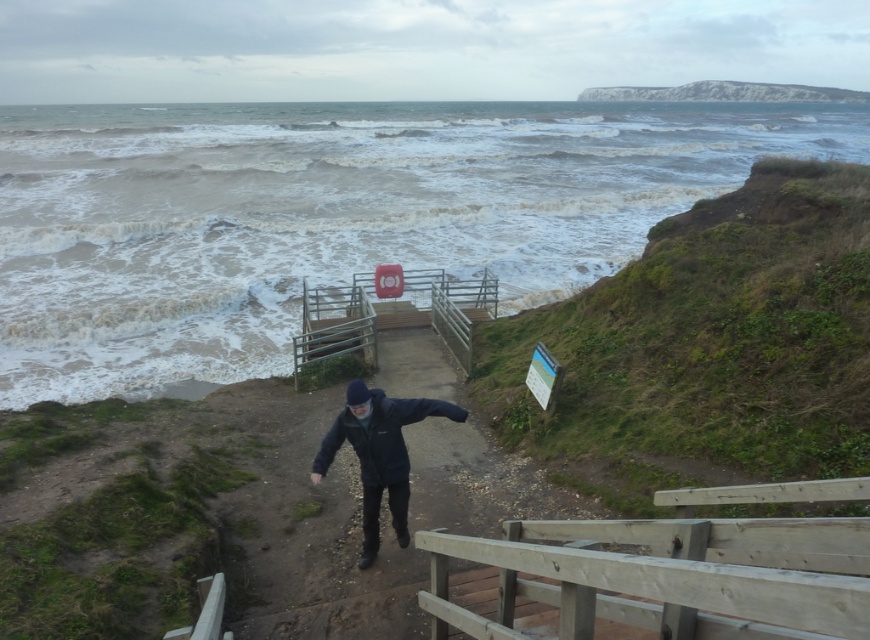
How much distance is there between green grassy cliff at right and wooden balustrade at lower right?

green grassy cliff at right and wooden balustrade at lower right are 8.47 meters apart.

Does green grassy cliff at right appear under wooden balustrade at lower right?

Actually, green grassy cliff at right is above wooden balustrade at lower right.

Is point (673, 282) less distant than point (864, 600)?

No, it is not.

This screenshot has width=870, height=640. I want to click on green grassy cliff at right, so click(x=706, y=346).

From the picture: Which of these two, wooden at center or white rocky cliff at upper right, stands taller?

white rocky cliff at upper right

From the picture: Is wooden at center bigger than white rocky cliff at upper right?

Incorrect, wooden at center is not larger than white rocky cliff at upper right.

Find the location of a particular element. Image resolution: width=870 pixels, height=640 pixels. wooden at center is located at coordinates (390, 314).

You are a GUI agent. You are given a task and a screenshot of the screen. Output one action in this format:
    pyautogui.click(x=<x>, y=<y>)
    Task: Click on the wooden at center
    The image size is (870, 640).
    Given the screenshot: What is the action you would take?
    pyautogui.click(x=390, y=314)

Can you confirm if wooden at center is shorter than dark blue jacket at center?

Indeed, wooden at center has a lesser height compared to dark blue jacket at center.

Consider the image. Is wooden at center further to the viewer compared to dark blue jacket at center?

Yes, wooden at center is further from the viewer.

What do you see at coordinates (390, 314) in the screenshot? This screenshot has width=870, height=640. I see `wooden at center` at bounding box center [390, 314].

In order to click on wooden at center in this screenshot , I will do `click(390, 314)`.